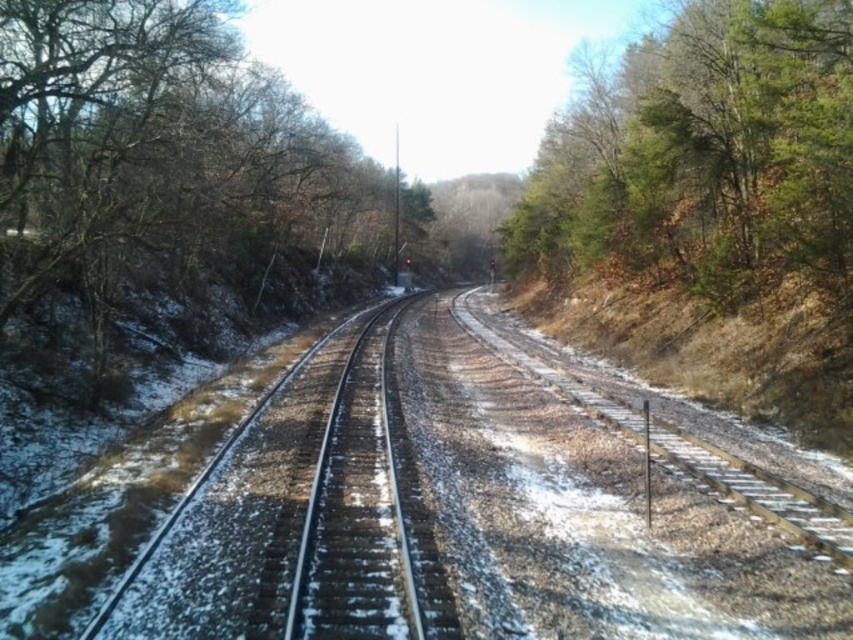
Based on the photo, who is more distant from viewer, (x=167, y=321) or (x=799, y=403)?

Point (x=167, y=321)

Which is more to the left, bare branches at left or green leafy tree at right?

bare branches at left

The height and width of the screenshot is (640, 853). Describe the element at coordinates (161, 192) in the screenshot. I see `bare branches at left` at that location.

Locate an element on the screen. The height and width of the screenshot is (640, 853). bare branches at left is located at coordinates (161, 192).